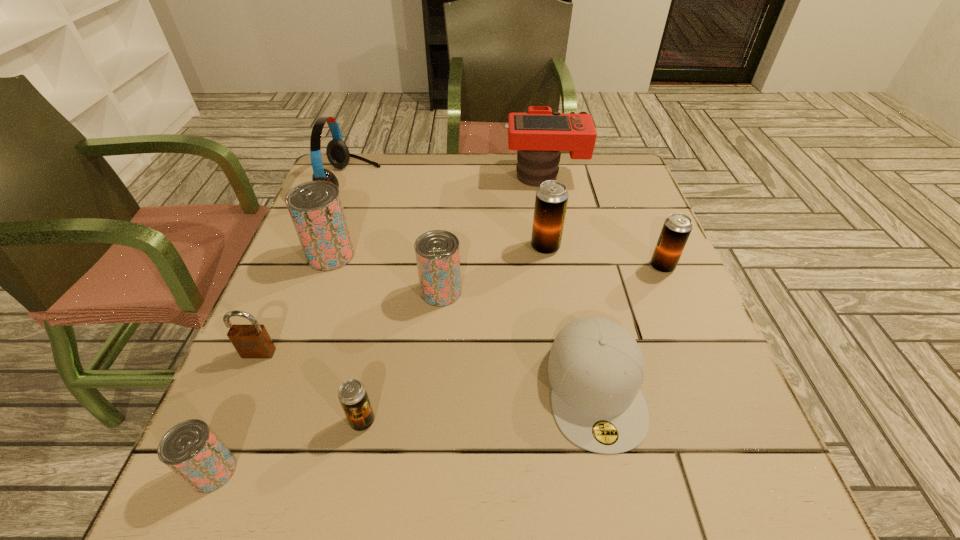
Where is `free region located on the back of the second biggest red beer can`? This screenshot has width=960, height=540. free region located on the back of the second biggest red beer can is located at coordinates (447, 220).

Identify the location of free space located 0.050m on the front-facing side of the padlock. Image resolution: width=960 pixels, height=540 pixels. (246, 382).

Locate an element on the screen. The height and width of the screenshot is (540, 960). free space located 0.050m on the front-facing side of the gray cap is located at coordinates (616, 488).

The height and width of the screenshot is (540, 960). Find the location of `free space located 0.200m on the right of the sixth object from right to left`. free space located 0.200m on the right of the sixth object from right to left is located at coordinates (496, 421).

The height and width of the screenshot is (540, 960). In order to click on free space located 0.250m on the right of the smallest red beer can in this screenshot , I will do `click(400, 471)`.

Image resolution: width=960 pixels, height=540 pixels. What are the coordinates of `headset that is at the far edge` in the screenshot? It's located at (337, 152).

You are a GUI agent. You are given a task and a screenshot of the screen. Output one action in this format:
    pyautogui.click(x=<x>, y=<y>)
    Task: Click on the camera that is at the far edge
    This screenshot has height=540, width=960.
    Given the screenshot: What is the action you would take?
    pyautogui.click(x=539, y=134)

Where is `cap situated at the near edge`? The height and width of the screenshot is (540, 960). cap situated at the near edge is located at coordinates (595, 368).

Locate an element on the screen. beer can located in the near edge section of the desktop is located at coordinates (190, 449).

You are a GUI agent. You are given a task and a screenshot of the screen. Output one action in this format:
    pyautogui.click(x=<x>, y=<y>)
    Task: Click on the headset located at the left edge
    
    Given the screenshot: What is the action you would take?
    pyautogui.click(x=337, y=152)